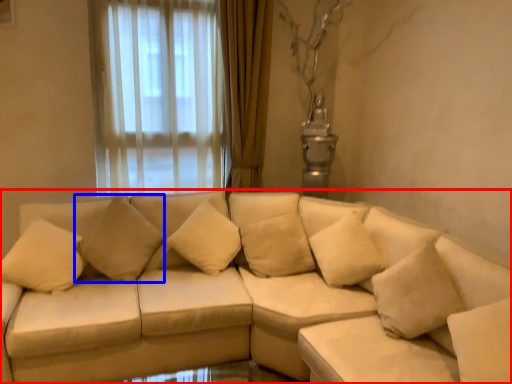
Question: Which object is closer to the camera taking this photo, studio couch (highlighted by a red box) or pillow (highlighted by a blue box)?

Choices:
 (A) studio couch
 (B) pillow

Answer: (A)